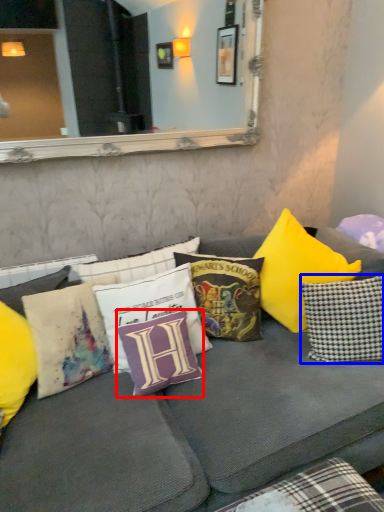
Question: Among these objects, which one is farthest to the camera, pillow (highlighted by a red box) or pillow (highlighted by a blue box)?

Choices:
 (A) pillow
 (B) pillow

Answer: (B)